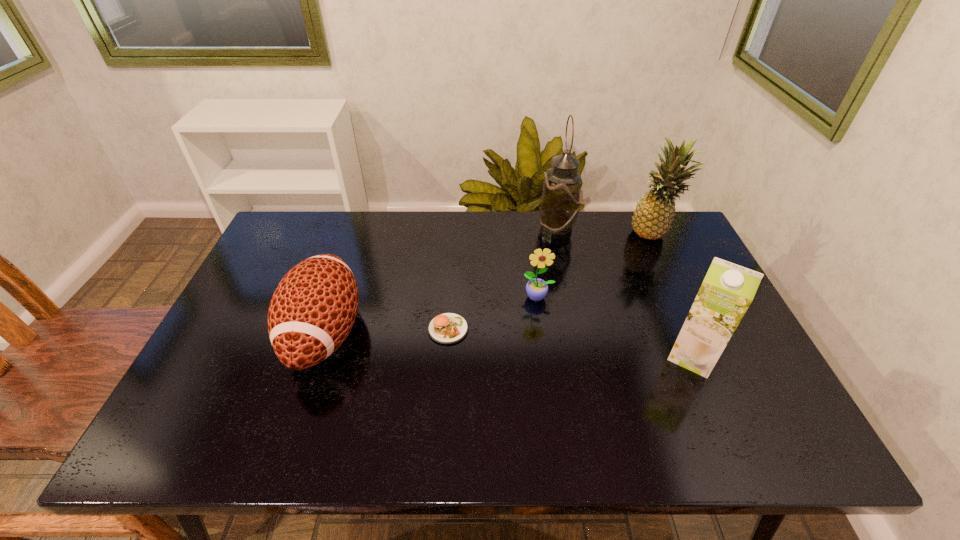
The width and height of the screenshot is (960, 540). What are the coordinates of `vacant area between the shortest object and the oil lamp` in the screenshot? It's located at (502, 280).

Identify which object is the second closest to the soya milk. Please provide its 2D coordinates. Your answer should be formatted as a tuple, i.e. [(x, y)], where the tuple contains the x and y coordinates of a point satisfying the conditions above.

[(652, 218)]

Identify which object is located as the fifth nearest to the sunflower. Please provide its 2D coordinates. Your answer should be formatted as a tuple, i.e. [(x, y)], where the tuple contains the x and y coordinates of a point satisfying the conditions above.

[(313, 309)]

Locate an element on the screen. This screenshot has width=960, height=540. free region that satisfies the following two spatial constraints: 1. on the back side of the shortest object; 2. on the right side of the oil lamp is located at coordinates (455, 230).

Where is `vacant space that satisfies the following two spatial constraints: 1. on the front side of the soya milk; 2. on the right side of the leftmost object`? This screenshot has width=960, height=540. vacant space that satisfies the following two spatial constraints: 1. on the front side of the soya milk; 2. on the right side of the leftmost object is located at coordinates (318, 356).

Where is `vacant space that satisfies the following two spatial constraints: 1. on the front-facing side of the soya milk; 2. on the left side of the sunflower`? Image resolution: width=960 pixels, height=540 pixels. vacant space that satisfies the following two spatial constraints: 1. on the front-facing side of the soya milk; 2. on the left side of the sunflower is located at coordinates (546, 356).